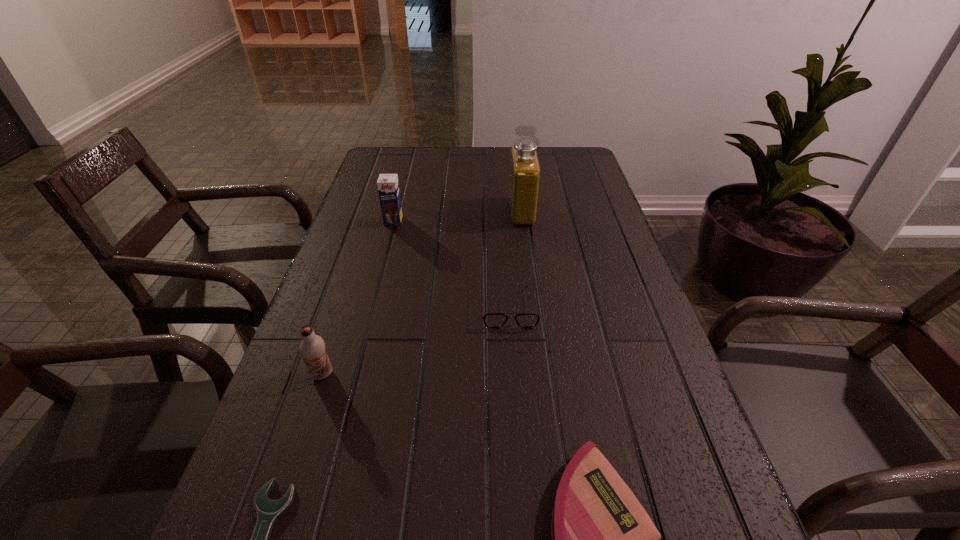
Locate an element on the screen. the tallest object is located at coordinates (524, 181).

This screenshot has height=540, width=960. I want to click on the third object from left to right, so click(x=388, y=186).

The image size is (960, 540). Identify the location of the farther chocolate milk. (388, 186).

What are the coordinates of `the nearer chocolate milk` in the screenshot? It's located at (312, 347).

Where is `the left chocolate milk`? Image resolution: width=960 pixels, height=540 pixels. the left chocolate milk is located at coordinates [312, 347].

The height and width of the screenshot is (540, 960). I want to click on the third shortest object, so click(494, 320).

Locate an element on the screen. This screenshot has height=540, width=960. the third farthest object is located at coordinates [494, 320].

This screenshot has height=540, width=960. In order to click on free space located on the front-facing side of the tallest object in this screenshot , I will do `click(464, 211)`.

At what (x,y) coordinates should I click in order to perform the action: click on free space located 0.090m on the front-facing side of the tallest object. Please return your answer as a coordinate pair (x, y). The width and height of the screenshot is (960, 540). Looking at the image, I should click on (478, 211).

Locate an element on the screen. free space located 0.320m on the front-facing side of the tallest object is located at coordinates (396, 211).